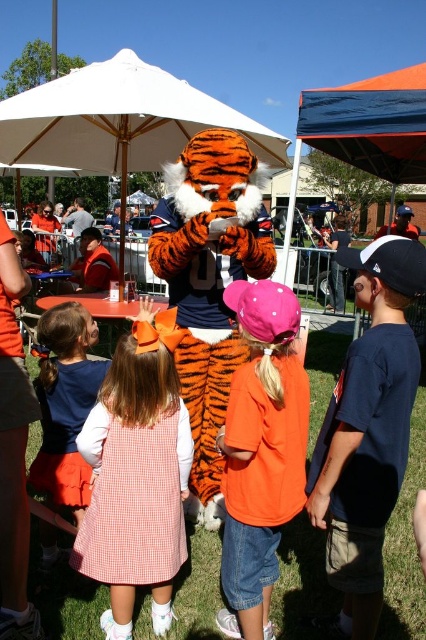
You are a photographer at the event. You need to take a photo of both the orange cotton shirt at center and the orange gingham dress at center. Which one should you focus on first if you want to capture them from left to right order?

You should focus on the orange gingham dress at center first because the orange cotton shirt at center is to the right of it, so the orange gingham dress at center comes first from left to right.

You are a photographer at the event and want to capture a photo of the mascot and the children. You need to ensure that the white fabric umbrella at center does not appear in the background. Based on its position, can you determine if the umbrella will be visible in the photo?

The white fabric umbrella at center is positioned at coordinates point [120,122]. Without additional information about the camera angle and framing, it is impossible to determine if it will be visible in the photo.